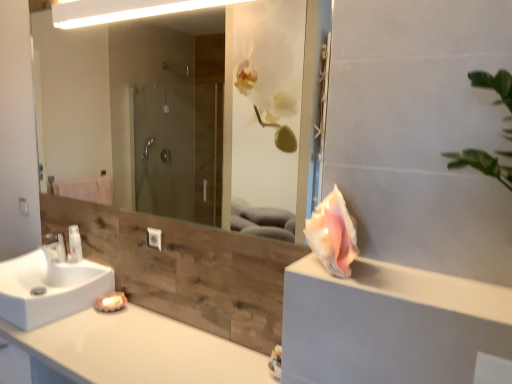
Where is `vacant area on top of white glossy countertop at lower left (from a real-world perspective)`? vacant area on top of white glossy countertop at lower left (from a real-world perspective) is located at coordinates (136, 342).